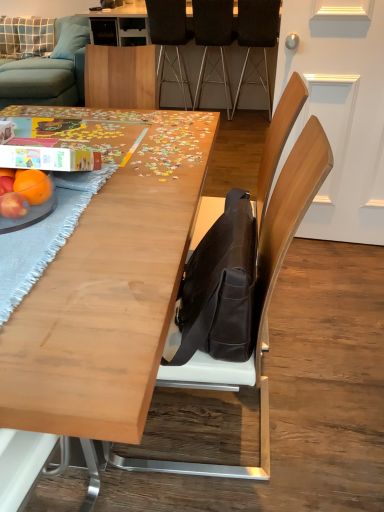
Question: Considering the relative positions of light blue fabric pillow at upper left, the first pillow when ordered from left to right, and matte orange at table left in the image provided, is light blue fabric pillow at upper left, the first pillow when ordered from left to right, to the right of matte orange at table left from the viewer's perspective?

Choices:
 (A) yes
 (B) no

Answer: (B)

Question: Is light blue fabric pillow at upper left, the first pillow when ordered from left to right, aimed at matte orange at table left?

Choices:
 (A) yes
 (B) no

Answer: (A)

Question: From a real-world perspective, is light blue fabric pillow at upper left, the first pillow when ordered from left to right, positioned over matte orange at table left based on gravity?

Choices:
 (A) no
 (B) yes

Answer: (A)

Question: Considering the relative sizes of light blue fabric pillow at upper left, which appears as the second pillow when viewed from the right, and matte orange at table left in the image provided, is light blue fabric pillow at upper left, which appears as the second pillow when viewed from the right, smaller than matte orange at table left?

Choices:
 (A) no
 (B) yes

Answer: (A)

Question: Is light blue fabric pillow at upper left, which appears as the second pillow when viewed from the right, further to camera compared to matte orange at table left?

Choices:
 (A) yes
 (B) no

Answer: (A)

Question: Is light blue fabric pillow at upper left, the first pillow when ordered from left to right, inside the boundaries of black leather chair at upper center, which is the first chair in back-to-front order, or outside?

Choices:
 (A) outside
 (B) inside

Answer: (A)

Question: From a real-world perspective, relative to black leather chair at upper center, which is the first chair in back-to-front order, is light blue fabric pillow at upper left, which appears as the second pillow when viewed from the right, vertically above or below?

Choices:
 (A) above
 (B) below

Answer: (A)

Question: Based on their positions, is light blue fabric pillow at upper left, which appears as the second pillow when viewed from the right, located to the left or right of black leather chair at upper center, which is the first chair in back-to-front order?

Choices:
 (A) right
 (B) left

Answer: (B)

Question: Is light blue fabric pillow at upper left, which appears as the second pillow when viewed from the right, bigger or smaller than black leather chair at upper center, which is the first chair in back-to-front order?

Choices:
 (A) big
 (B) small

Answer: (B)

Question: From the image's perspective, relative to light blue fabric couch at upper left, is matte black messenger bag at center above or below?

Choices:
 (A) below
 (B) above

Answer: (A)

Question: From a real-world perspective, is matte black messenger bag at center positioned above or below light blue fabric couch at upper left?

Choices:
 (A) above
 (B) below

Answer: (A)

Question: Is matte black messenger bag at center taller or shorter than light blue fabric couch at upper left?

Choices:
 (A) short
 (B) tall

Answer: (A)

Question: Considering their positions, is matte black messenger bag at center located in front of or behind light blue fabric couch at upper left?

Choices:
 (A) behind
 (B) front

Answer: (B)

Question: Considering the positions of matte orange at table left and brown leather chair at center, which is the 4th chair from back to front, in the image, is matte orange at table left wider or thinner than brown leather chair at center, which is the 4th chair from back to front,?

Choices:
 (A) thin
 (B) wide

Answer: (A)

Question: Is matte orange at table left to the left or to the right of brown leather chair at center, which is the 4th chair from back to front, in the image?

Choices:
 (A) right
 (B) left

Answer: (B)